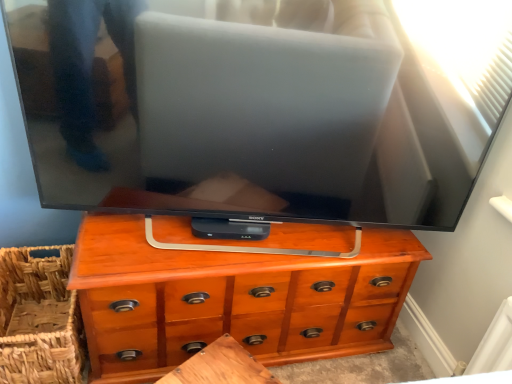
Question: From the image's perspective, is wooden table at center on woven brown basket at lower left?

Choices:
 (A) no
 (B) yes

Answer: (A)

Question: Is wooden table at center shorter than woven brown basket at lower left?

Choices:
 (A) no
 (B) yes

Answer: (B)

Question: From a real-world perspective, is wooden table at center located beneath woven brown basket at lower left?

Choices:
 (A) yes
 (B) no

Answer: (A)

Question: Considering the relative sizes of wooden table at center and woven brown basket at lower left in the image provided, is wooden table at center taller than woven brown basket at lower left?

Choices:
 (A) no
 (B) yes

Answer: (A)

Question: Considering the relative sizes of wooden table at center and woven brown basket at lower left in the image provided, is wooden table at center bigger than woven brown basket at lower left?

Choices:
 (A) no
 (B) yes

Answer: (A)

Question: Considering the relative sizes of wooden table at center and woven brown basket at lower left in the image provided, is wooden table at center thinner than woven brown basket at lower left?

Choices:
 (A) no
 (B) yes

Answer: (B)

Question: Are woven brown basket at lower left and wooden table at center located far from each other?

Choices:
 (A) no
 (B) yes

Answer: (A)

Question: Does woven brown basket at lower left have a greater width compared to wooden table at center?

Choices:
 (A) no
 (B) yes

Answer: (B)

Question: Can you confirm if woven brown basket at lower left is bigger than wooden table at center?

Choices:
 (A) no
 (B) yes

Answer: (B)

Question: Is woven brown basket at lower left turned away from wooden table at center?

Choices:
 (A) yes
 (B) no

Answer: (B)

Question: Does woven brown basket at lower left come in front of wooden table at center?

Choices:
 (A) no
 (B) yes

Answer: (A)

Question: Is woven brown basket at lower left to the right of wooden table at center from the viewer's perspective?

Choices:
 (A) yes
 (B) no

Answer: (B)

Question: Can you confirm if woven brown basket at lower left is wider than wooden chest of drawers at center?

Choices:
 (A) yes
 (B) no

Answer: (A)